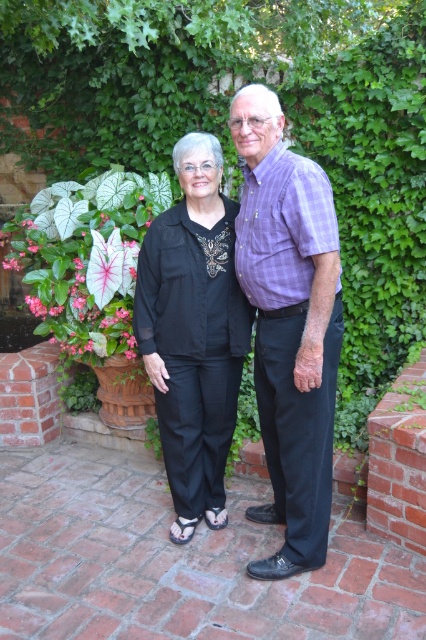
Question: Among these points, which one is farthest from the camera?

Choices:
 (A) (164, 234)
 (B) (74, 236)
 (C) (316, 240)

Answer: (B)

Question: Which point is closer to the camera?

Choices:
 (A) (91, 236)
 (B) (189, 468)
 (C) (282, 248)

Answer: (C)

Question: Can you confirm if purple checkered shirt at center is positioned above black cotton pants at center?

Choices:
 (A) yes
 (B) no

Answer: (A)

Question: Where is black cotton pants at center located in relation to white matte caladium leaf at center in the image?

Choices:
 (A) right
 (B) left

Answer: (A)

Question: Among these points, which one is nearest to the camera?

Choices:
 (A) (213, 358)
 (B) (327, 317)
 (C) (80, 308)

Answer: (B)

Question: Can you confirm if purple checkered shirt at center is wider than black cotton pants at center?

Choices:
 (A) yes
 (B) no

Answer: (B)